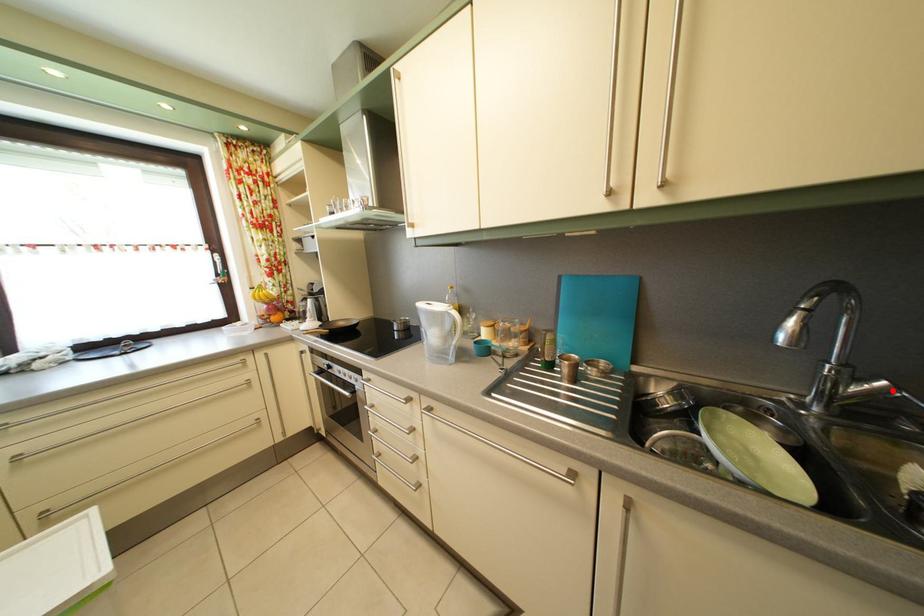
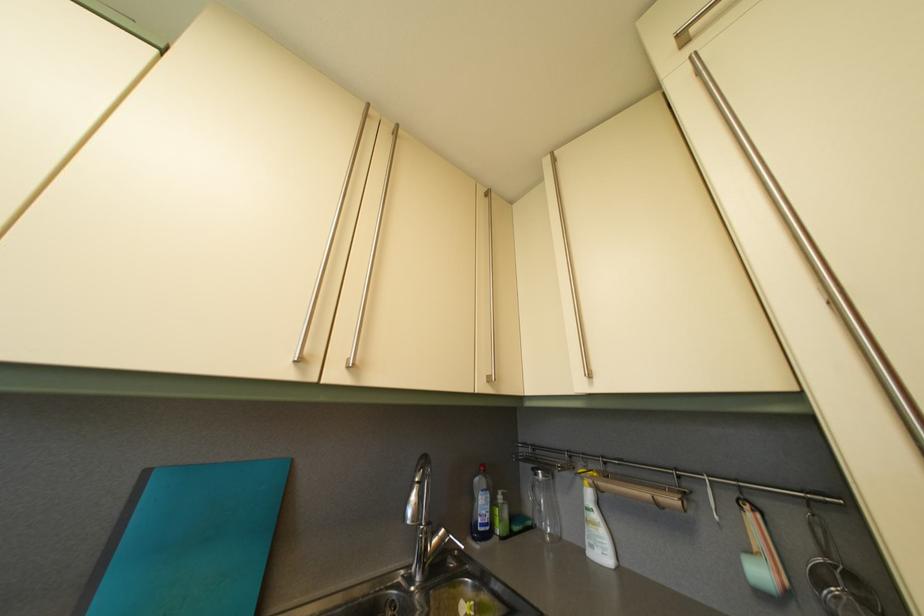
Question: I am providing you with two images of the same scene from different viewpoints. A red point is marked on the first image. Is the red point's position out of view in image 2?

Choices:
 (A) Yes
 (B) No

Answer: (B)